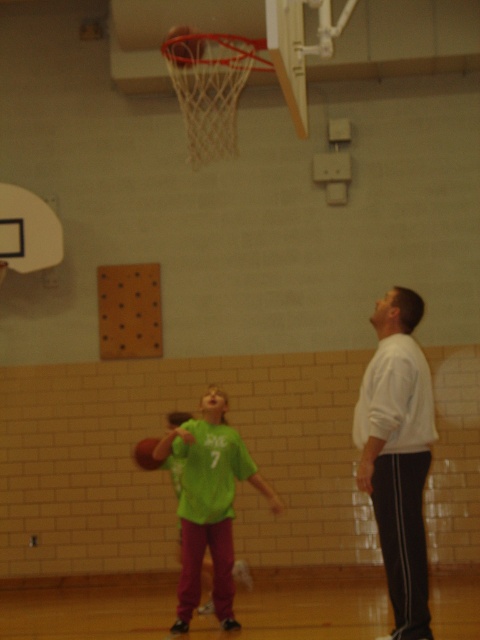
Question: Which point appears closest to the camera in this image?

Choices:
 (A) (143, 451)
 (B) (402, 420)
 (C) (175, 449)

Answer: (B)

Question: Is white smooth shirt at right below rubber basketball at lower center?

Choices:
 (A) yes
 (B) no

Answer: (B)

Question: Is rubber textured basketball at center thinner than rubber basketball at lower center?

Choices:
 (A) no
 (B) yes

Answer: (B)

Question: Considering the real-world distances, which object is farthest from the green matte shirt at center?

Choices:
 (A) rubber basketball at lower center
 (B) rubber textured basketball at center

Answer: (B)

Question: Among these points, which one is farthest from the camera?

Choices:
 (A) (194, 40)
 (B) (228, 568)
 (C) (152, 456)

Answer: (C)

Question: Does white smooth shirt at right appear under rubber basketball at lower center?

Choices:
 (A) no
 (B) yes

Answer: (A)